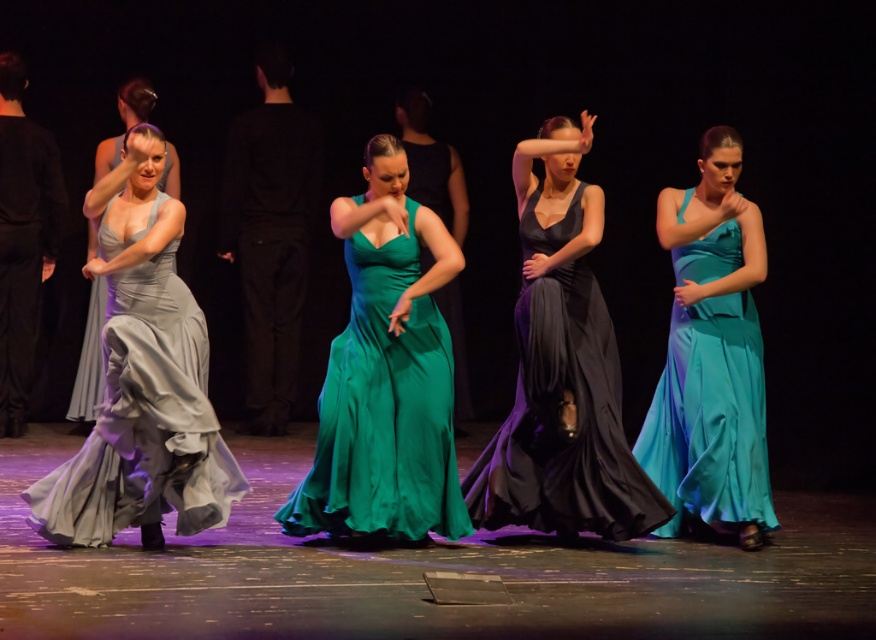
You are a photographer positioned at the front of the stage. You want to capture a closeup shot of the green satin dress at center. Based on its position, where should you aim your camera to ensure the dress is centered in your frame?

The green satin dress at center is located at point (x=431, y=163), so you should aim your camera at those coordinates to center the dress in your frame.

You are a photographer at the back of the stage. You want to capture the point at the center of the stage which is represented by point [562,369]. However, there is a matte black dress at center blocking your view. Can you still take a clear photo of the point?

The matte black dress at center is represented by point [562,369], so the dress is exactly at the point you want to capture. Therefore, you cannot take a clear photo of the point without the dress obstructing it.

You are a stagehand preparing to adjust the lighting for the performance. The spotlight needs to cover both the matte black dress at center and the satin silver dress at left. Given that the spotlight has a maximum range of 10 feet, will it be able to illuminate both dresses simultaneously?

The matte black dress at center is 12.91 feet from the satin silver dress at left. Since the spotlight can only cover up to 10 feet, it cannot illuminate both dresses at the same time.